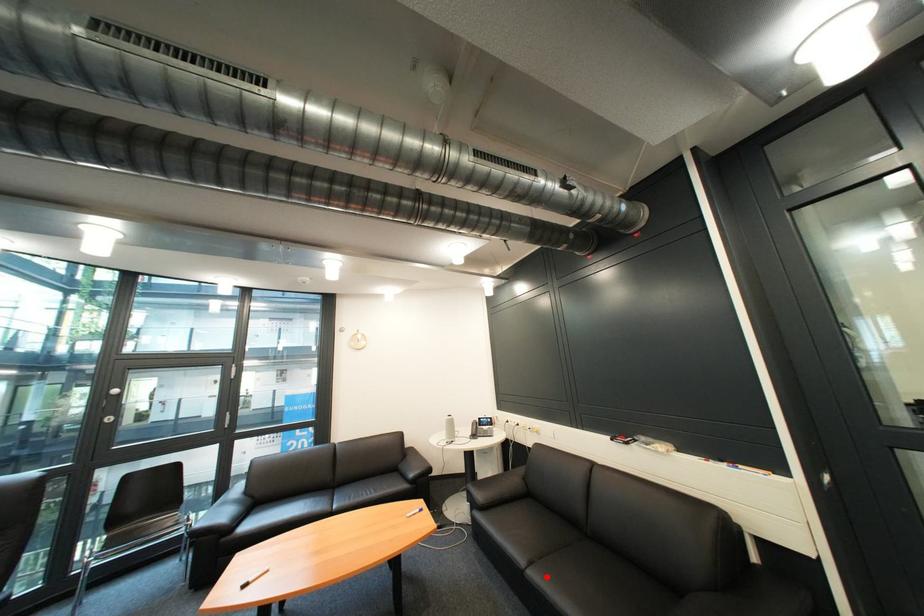
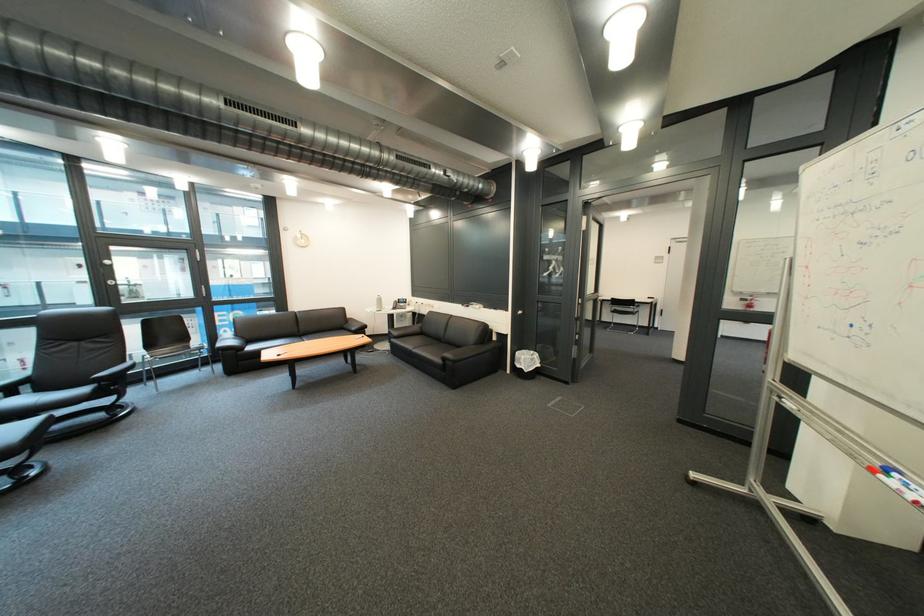
In the second image, find the point that corresponds to the highlighted location in the first image.

(429, 353)